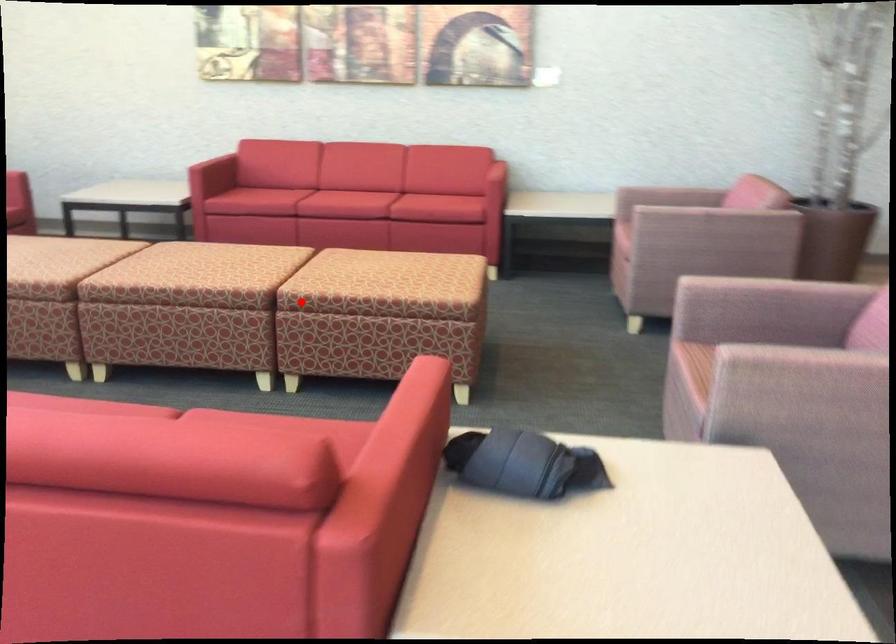
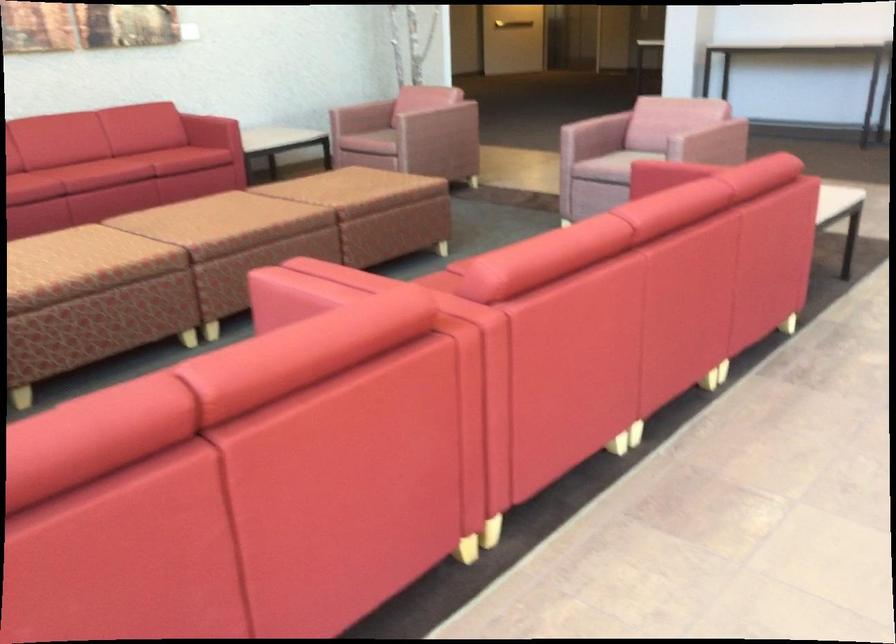
Where in the second image is the point corresponding to the highlighted location from the first image?

(380, 212)